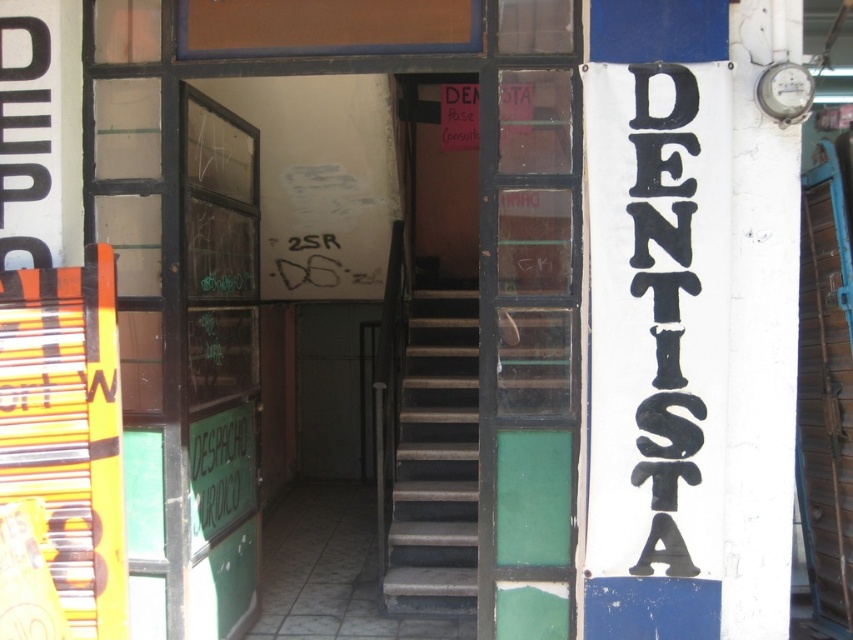
Who is more distant from viewer, (515, 173) or (206, 552)?

Point (206, 552)

Does green glass door at center have a greater height compared to green glass door at left?

No.

Does point (480, 461) come closer to viewer compared to point (219, 195)?

Yes.

Locate an element on the screen. green glass door at center is located at coordinates (527, 353).

Which of these two, green glass door at center or dark gray concrete stairs at center, stands shorter?

dark gray concrete stairs at center is shorter.

Does point (498, 237) lie behind point (401, 385)?

No, it is not.

The height and width of the screenshot is (640, 853). What do you see at coordinates (527, 353) in the screenshot? I see `green glass door at center` at bounding box center [527, 353].

Find the location of `green glass door at center`. green glass door at center is located at coordinates [527, 353].

Is point (189, 132) positioned after point (477, 387)?

No, (189, 132) is in front of (477, 387).

Which is behind, point (236, 355) or point (405, 506)?

The point (405, 506) is behind.

In order to click on green glass door at left in this screenshot , I will do `click(221, 360)`.